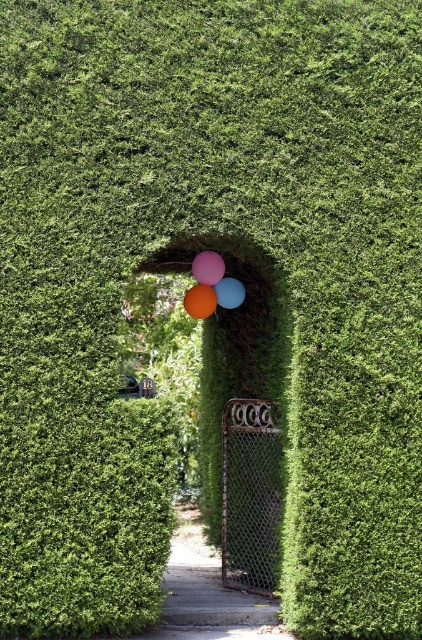
Who is more forward, (259, 468) or (191, 291)?

Point (191, 291) is in front.

Is point (264, 522) less distant than point (211, 292)?

No, (264, 522) is behind (211, 292).

Locate an element on the screen. The height and width of the screenshot is (640, 422). rusty chain-link fence at center is located at coordinates [x=251, y=493].

Does orange matte balloon at center appear under blue glossy balloon at center?

Yes.

What do you see at coordinates (200, 301) in the screenshot?
I see `orange matte balloon at center` at bounding box center [200, 301].

Identify the location of orange matte balloon at center. (200, 301).

Image resolution: width=422 pixels, height=640 pixels. What are the coordinates of `orange matte balloon at center` in the screenshot? It's located at (x=200, y=301).

Is rusty chain-link fence at center bigger than matte orange balloon at center?

Yes, rusty chain-link fence at center is bigger than matte orange balloon at center.

Does rusty chain-link fence at center have a lesser height compared to matte orange balloon at center?

No.

Find the location of a particular element. The height and width of the screenshot is (640, 422). rusty chain-link fence at center is located at coordinates (251, 493).

Locate an element on the screen. The image size is (422, 640). rusty chain-link fence at center is located at coordinates (251, 493).